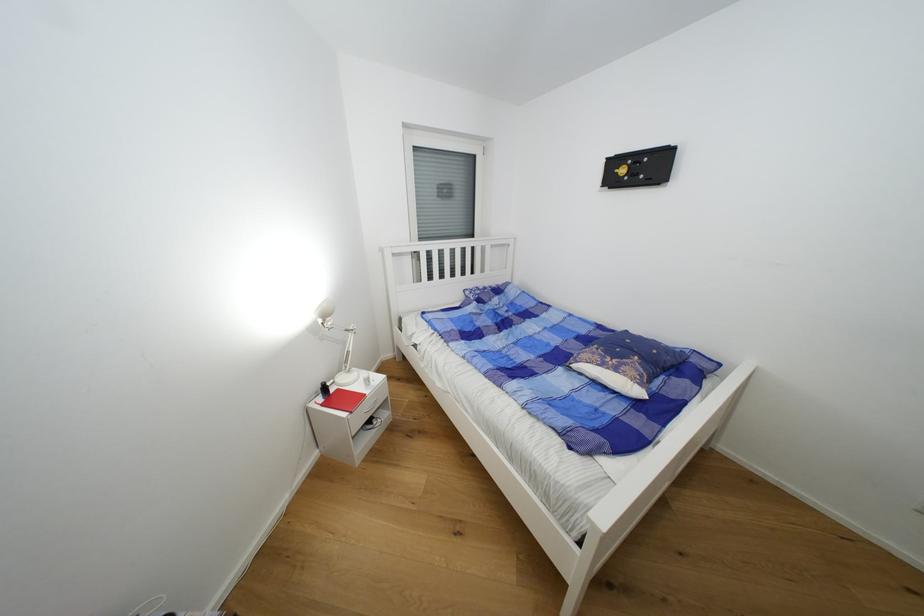
Image resolution: width=924 pixels, height=616 pixels. What do you see at coordinates (323, 313) in the screenshot?
I see `the white lamp head` at bounding box center [323, 313].